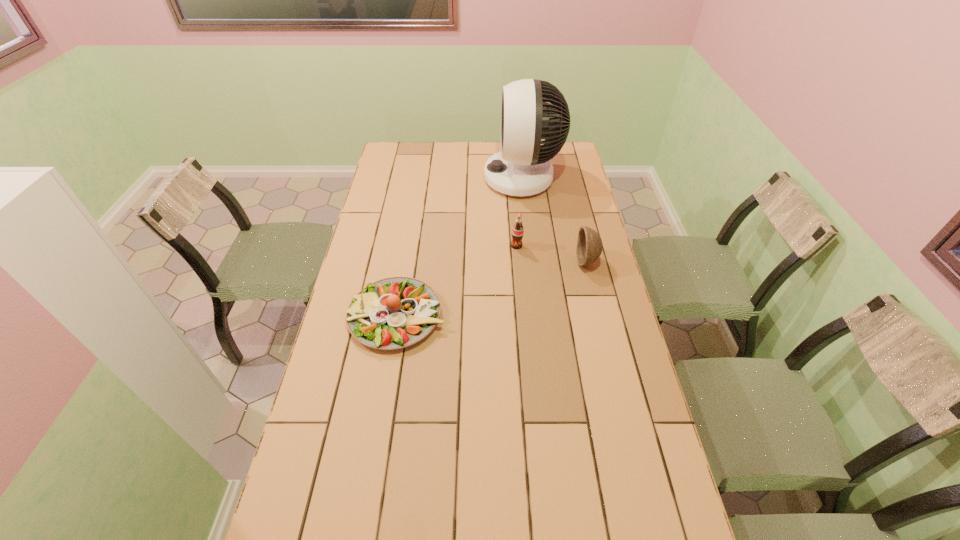
At what (x,y) coordinates should I click in order to perform the action: click on free space at the far left corner of the desktop. Please return your answer as a coordinate pair (x, y). This screenshot has width=960, height=540. Looking at the image, I should click on (395, 146).

Where is `vacant point located between the bowl and the nearest object`? The height and width of the screenshot is (540, 960). vacant point located between the bowl and the nearest object is located at coordinates (492, 288).

Where is `vacant area between the salad plate and the tallest object`? vacant area between the salad plate and the tallest object is located at coordinates (460, 247).

This screenshot has height=540, width=960. What are the coordinates of `vacant area that lies between the leftmost object and the bowl` in the screenshot? It's located at (492, 288).

At what (x,y) coordinates should I click in order to perform the action: click on vacant region between the bowl and the soda. Please return your answer as a coordinate pair (x, y). Looking at the image, I should click on (552, 253).

The height and width of the screenshot is (540, 960). Identify the location of blank region between the bowl and the leftmost object. (492, 288).

I want to click on vacant area that lies between the fan and the soda, so click(519, 212).

Locate an element on the screen. This screenshot has height=540, width=960. unoccupied area between the tallest object and the bowl is located at coordinates (555, 220).

Identify the location of vacant space in between the leftmost object and the farthest object. The image size is (960, 540). (460, 247).

Select which object is the second closest to the soda. Please provide its 2D coordinates. Your answer should be formatted as a tuple, i.e. [(x, y)], where the tuple contains the x and y coordinates of a point satisfying the conditions above.

[(522, 168)]